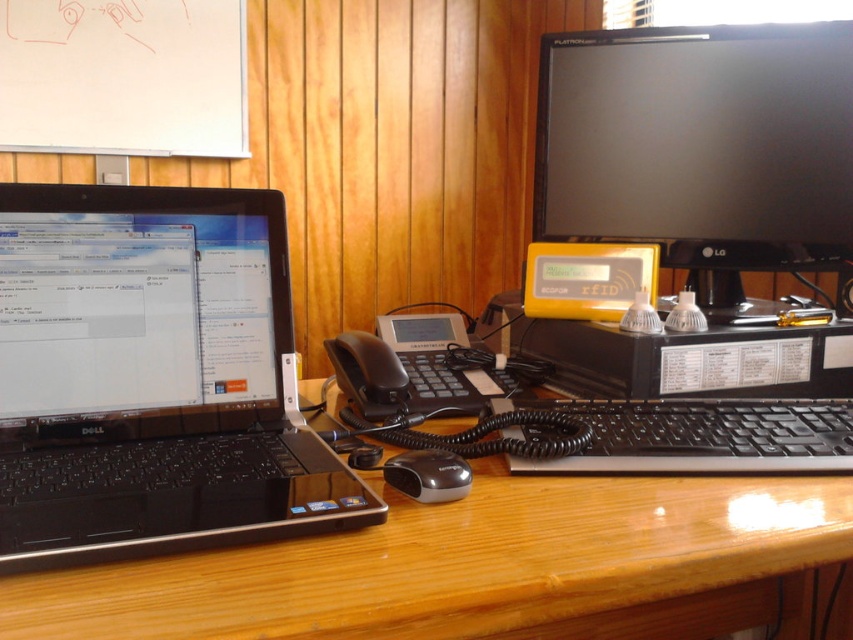
Who is taller, wooden at center or black plastic keyboard at center?

Standing taller between the two is wooden at center.

Looking at this image, is wooden at center to the right of black plastic keyboard at center from the viewer's perspective?

No, wooden at center is not to the right of black plastic keyboard at center.

Is point (479, 502) positioned before point (734, 451)?

Yes.

Image resolution: width=853 pixels, height=640 pixels. Identify the location of wooden at center. (479, 566).

Does black glossy monitor at upper right appear on the left side of black plastic keyboard at center?

In fact, black glossy monitor at upper right is to the right of black plastic keyboard at center.

Describe the element at coordinates (700, 147) in the screenshot. I see `black glossy monitor at upper right` at that location.

Locate an element on the screen. The width and height of the screenshot is (853, 640). black glossy monitor at upper right is located at coordinates (700, 147).

In order to click on black glossy monitor at upper right in this screenshot , I will do `click(700, 147)`.

Between black matte laptop at left and black glossy monitor at upper right, which one has less height?

black matte laptop at left is shorter.

In order to click on black matte laptop at left in this screenshot , I will do `click(152, 378)`.

Is point (88, 438) positioned after point (793, 97)?

No, it is not.

You are a GUI agent. You are given a task and a screenshot of the screen. Output one action in this format:
    pyautogui.click(x=<x>, y=<y>)
    Task: Click on the black matte laptop at left
    This screenshot has height=640, width=853.
    Given the screenshot: What is the action you would take?
    pyautogui.click(x=152, y=378)